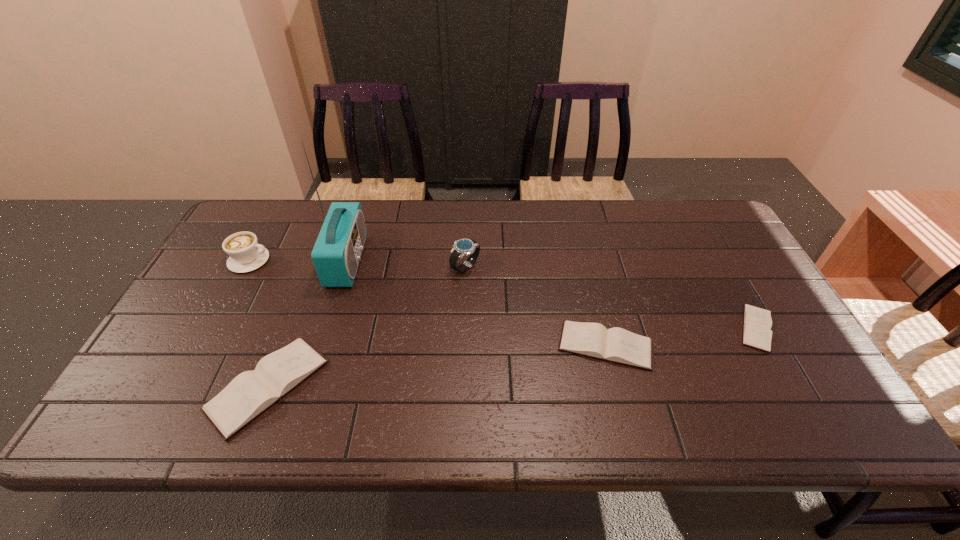
I want to click on vacant space at the left edge, so click(223, 299).

In the image, there is a desktop. Where is `free region at the right edge`? free region at the right edge is located at coordinates (687, 253).

Locate an element on the screen. The width and height of the screenshot is (960, 540). vacant space at the far left corner is located at coordinates (273, 240).

You are a GUI agent. You are given a task and a screenshot of the screen. Output one action in this format:
    pyautogui.click(x=<x>, y=<y>)
    Task: Click on the vacant point at the near right corner
    Image resolution: width=960 pixels, height=540 pixels.
    Given the screenshot: What is the action you would take?
    pyautogui.click(x=766, y=393)

The image size is (960, 540). I want to click on free space between the fourth shortest object and the radio receiver, so click(299, 260).

Where is `unoccupied position between the rightmost object and the fourth object from left to right`? This screenshot has width=960, height=540. unoccupied position between the rightmost object and the fourth object from left to right is located at coordinates (611, 298).

You are a GUI agent. You are given a task and a screenshot of the screen. Output one action in this format:
    pyautogui.click(x=<x>, y=<y>)
    Task: Click on the free space between the second object from right to left and the leftmost diary
    This screenshot has height=540, width=960.
    Given the screenshot: What is the action you would take?
    pyautogui.click(x=437, y=366)

You are a GUI agent. You are given a task and a screenshot of the screen. Output one action in this format:
    pyautogui.click(x=<x>, y=<y>)
    Task: Click on the vacant area that lies between the fifth tallest object and the rightmost diary
    The height and width of the screenshot is (540, 960).
    Given the screenshot: What is the action you would take?
    pyautogui.click(x=681, y=337)

Identify the location of free space between the leftmost diary and the watch. Image resolution: width=960 pixels, height=540 pixels. (367, 326).

You are a GUI agent. You are given a task and a screenshot of the screen. Output one action in this format:
    pyautogui.click(x=<x>, y=<y>)
    Task: Click on the vacant area that lies between the tallest object and the second shortest diary
    This screenshot has width=960, height=540.
    Given the screenshot: What is the action you would take?
    pyautogui.click(x=476, y=303)